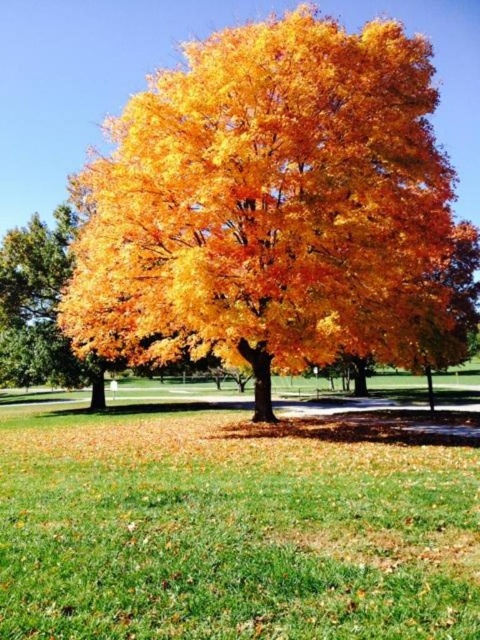
You are standing in the autumn scene and notice the golden yellow leaves at center and the green grass at center. Which object is positioned to the left of the other?

The golden yellow leaves at center are to the left of the green grass at center.

You are standing in the autumn scene and want to place a small garden gnome exactly at the center of the image. Which object from the golden yellow leaves at center and green grass at center will the gnome be placed on top of?

The garden gnome will be placed on top of the green grass at center because the golden yellow leaves at center are taller than the green grass at center, meaning the grass is lower and forms the base where the gnome can be placed.

You are standing in the autumn scene and want to pick up a leaf from the golden yellow leaves at center. Can you reach the leaves without stepping on the green grass at center?

The golden yellow leaves at center are above the green grass at center, so you can reach them without stepping on the grass by bending down or leaning over.